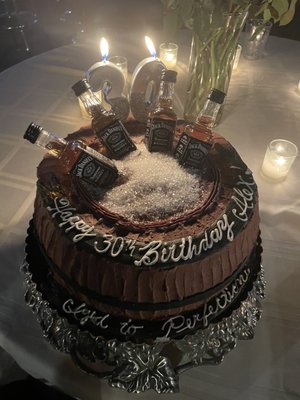
Identify the location of bottles. (86, 165), (115, 125), (162, 141), (201, 134).